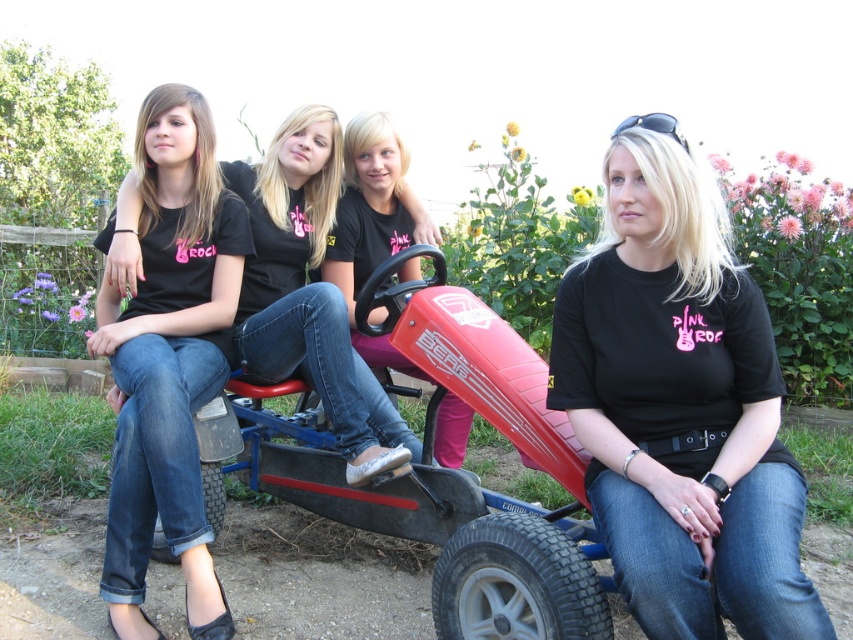
Question: Is matte black shirt at left to the right of matte black t-shirt at center from the viewer's perspective?

Choices:
 (A) no
 (B) yes

Answer: (A)

Question: Which object is closer to the camera taking this photo?

Choices:
 (A) matte black t-shirt at center
 (B) matte black shirt at left
 (C) black matte t-shirt at center

Answer: (C)

Question: Is black matte t-shirt at center further to the viewer compared to matte black t-shirt at center?

Choices:
 (A) no
 (B) yes

Answer: (A)

Question: Which of these objects is positioned closest to the matte black shirt at left?

Choices:
 (A) matte black t-shirt at center
 (B) metallic red go-kart at center

Answer: (A)

Question: Does metallic red go-kart at center have a lesser width compared to matte black shirt at left?

Choices:
 (A) yes
 (B) no

Answer: (B)

Question: Which of the following is the closest to the observer?

Choices:
 (A) (126, 566)
 (B) (648, 454)

Answer: (B)